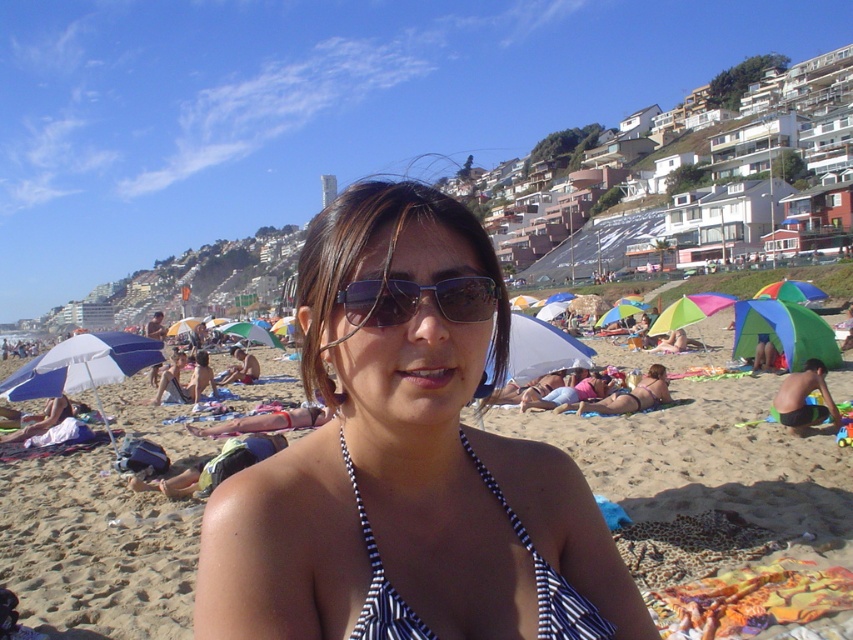
Question: Estimate the real-world distances between objects in this image. Which object is farther from the white striped bikini top at center?

Choices:
 (A) multicolored fabric umbrella at center
 (B) matte black bikini top at center
 (C) sunglasses at center
 (D) black striped bikini top at center

Answer: (A)

Question: Which point is farther to the camera?

Choices:
 (A) matte bikini top at center
 (B) matte black bikini top at center
 (C) white striped bikini top at center
 (D) sunglasses at center

Answer: (B)

Question: Does white striped bikini top at center have a lesser width compared to matte black bikini top at center?

Choices:
 (A) yes
 (B) no

Answer: (B)

Question: Considering the relative positions of white fabric umbrella at left and matte bikini top at center in the image provided, where is white fabric umbrella at left located with respect to matte bikini top at center?

Choices:
 (A) below
 (B) above

Answer: (A)

Question: Which point is farther to the camera?

Choices:
 (A) white fabric umbrella at left
 (B) matte bikini top at center
 (C) black and white striped bikini top at center
 (D) black striped bikini top at center

Answer: (B)

Question: Can you confirm if sunglasses at center is positioned to the right of matte bikini top at center?

Choices:
 (A) no
 (B) yes

Answer: (A)